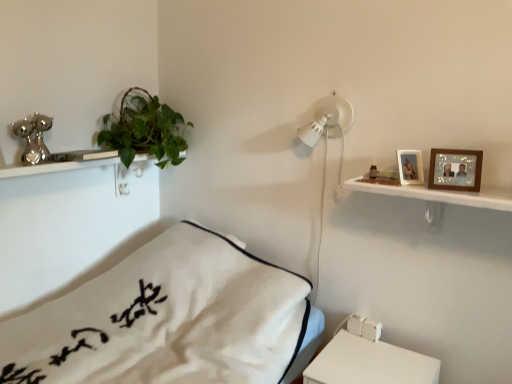
Question: Does wooden picture frame at upper right, acting as the 2th picture frame starting from the left, have a larger size compared to green leafy plant at upper left?

Choices:
 (A) no
 (B) yes

Answer: (A)

Question: Does wooden picture frame at upper right, placed as the 1th picture frame when sorted from right to left, have a lesser width compared to green leafy plant at upper left?

Choices:
 (A) yes
 (B) no

Answer: (A)

Question: Is wooden picture frame at upper right, placed as the 1th picture frame when sorted from right to left, at the right side of green leafy plant at upper left?

Choices:
 (A) no
 (B) yes

Answer: (B)

Question: Is wooden picture frame at upper right, arranged as the second picture frame when viewed from the back, further to the viewer compared to green leafy plant at upper left?

Choices:
 (A) yes
 (B) no

Answer: (B)

Question: Is wooden picture frame at upper right, acting as the 2th picture frame starting from the left, facing away from green leafy plant at upper left?

Choices:
 (A) yes
 (B) no

Answer: (B)

Question: Relative to wooden photo frame at upper right, marked as the 2th picture frame in a right-to-left arrangement, is white matte table at lower right in front or behind?

Choices:
 (A) behind
 (B) front

Answer: (B)

Question: In terms of size, does white matte table at lower right appear bigger or smaller than wooden photo frame at upper right, the first picture frame in the back-to-front sequence?

Choices:
 (A) small
 (B) big

Answer: (B)

Question: From the image's perspective, is white matte table at lower right above or below wooden photo frame at upper right, marked as the 2th picture frame in a right-to-left arrangement?

Choices:
 (A) below
 (B) above

Answer: (A)

Question: From a real-world perspective, is white matte table at lower right physically located above or below wooden photo frame at upper right, positioned as the second picture frame in front-to-back order?

Choices:
 (A) above
 (B) below

Answer: (B)

Question: Is wooden picture frame at upper right, arranged as the second picture frame when viewed from the back, bigger or smaller than white cotton bed at center?

Choices:
 (A) small
 (B) big

Answer: (A)

Question: Is wooden picture frame at upper right, placed as the 1th picture frame when sorted from right to left, wider or thinner than white cotton bed at center?

Choices:
 (A) wide
 (B) thin

Answer: (B)

Question: From a real-world perspective, is wooden picture frame at upper right, the 1th picture frame viewed from the front, physically located above or below white cotton bed at center?

Choices:
 (A) above
 (B) below

Answer: (A)

Question: From the image's perspective, is wooden picture frame at upper right, acting as the 2th picture frame starting from the left, positioned above or below white cotton bed at center?

Choices:
 (A) below
 (B) above

Answer: (B)

Question: From the image's perspective, is wooden photo frame at upper right, positioned as the second picture frame in front-to-back order, located above or below white matte table at lower right?

Choices:
 (A) below
 (B) above

Answer: (B)

Question: Is wooden photo frame at upper right, positioned as the second picture frame in front-to-back order, inside or outside of white matte table at lower right?

Choices:
 (A) outside
 (B) inside

Answer: (A)